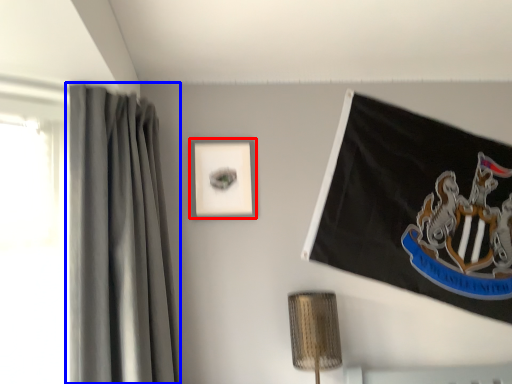
Question: Which object appears closest to the camera in this image, picture frame (highlighted by a red box) or curtain (highlighted by a blue box)?

Choices:
 (A) picture frame
 (B) curtain

Answer: (B)